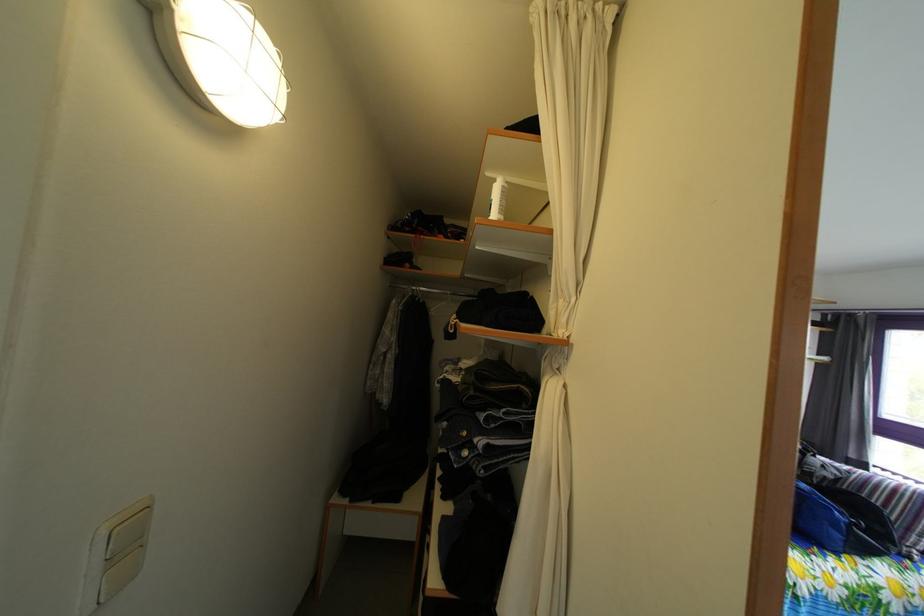
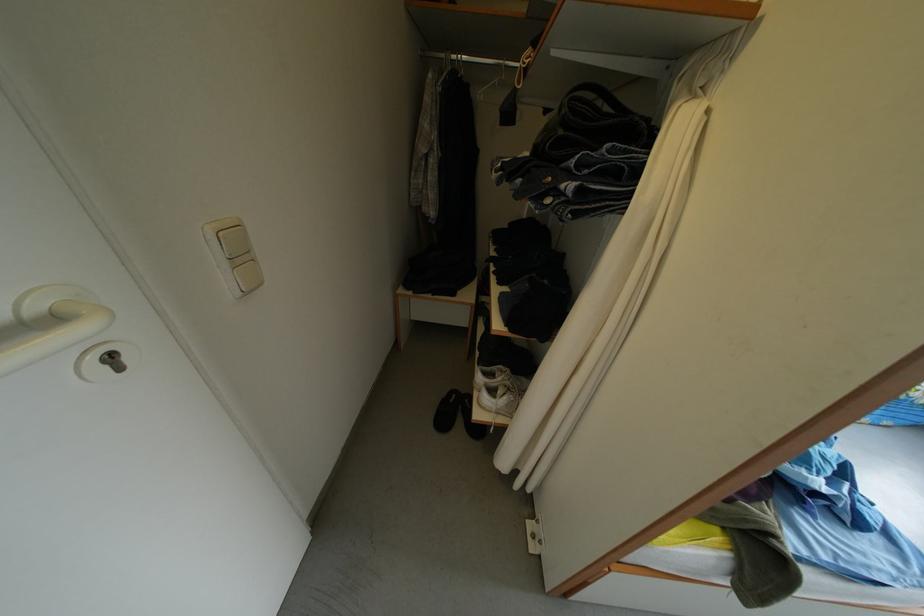
In the second image, find the point that corresponds to [540,456] in the first image.

(639, 204)